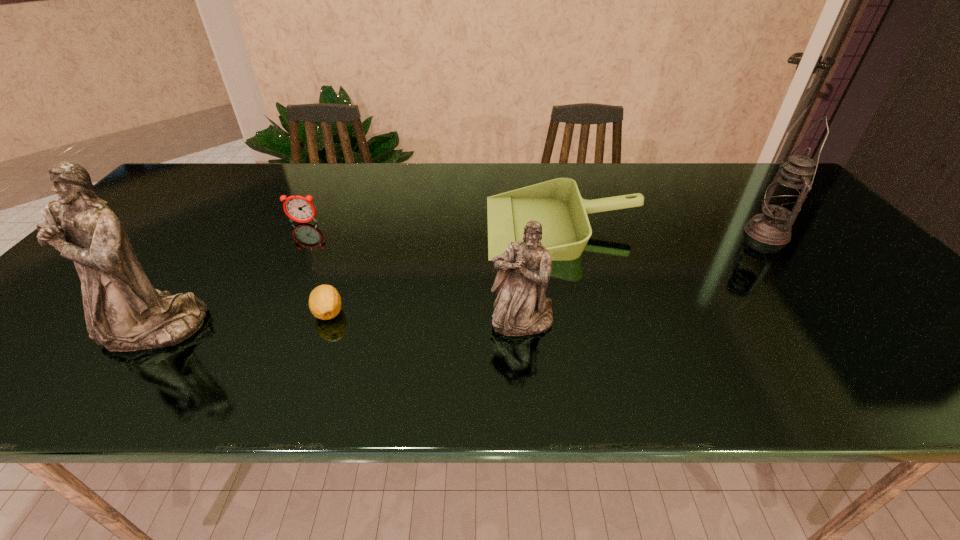
Please point a spot to add another figurine on the right. Please provide its 2D coordinates. Your answer should be formatted as a tuple, i.e. [(x, y)], where the tuple contains the x and y coordinates of a point satisfying the conditions above.

[(879, 314)]